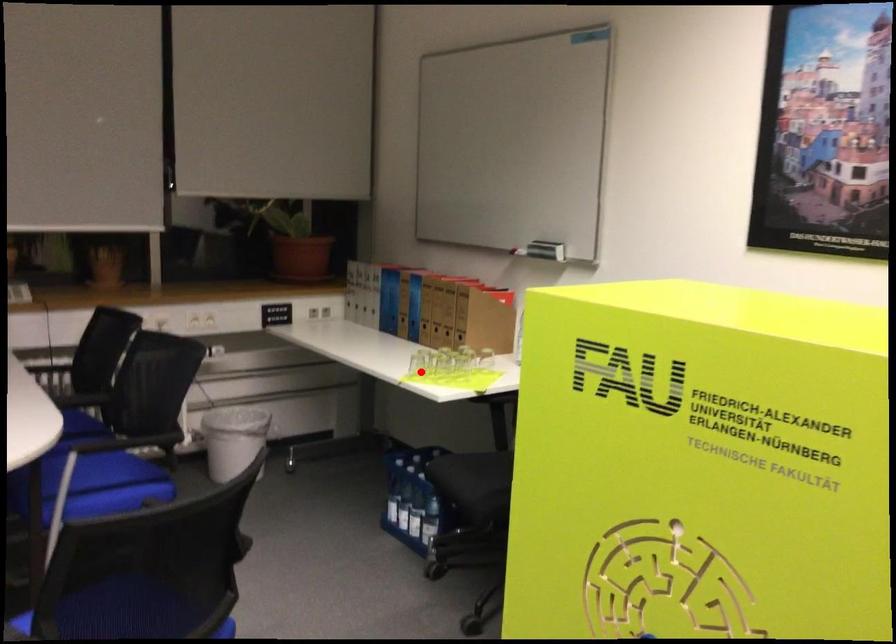
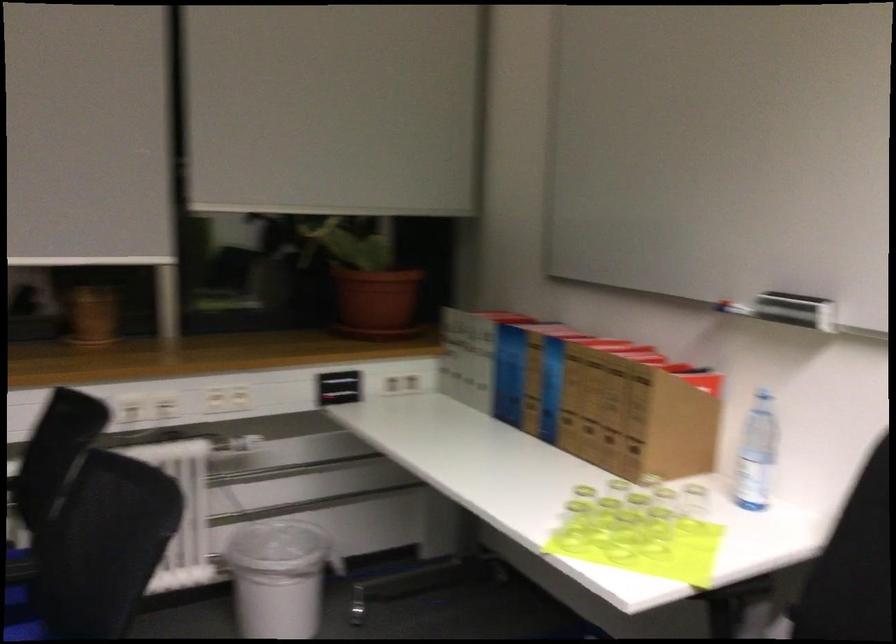
Where in the second image is the point corresponding to the highlighted location from the first image?

(573, 526)